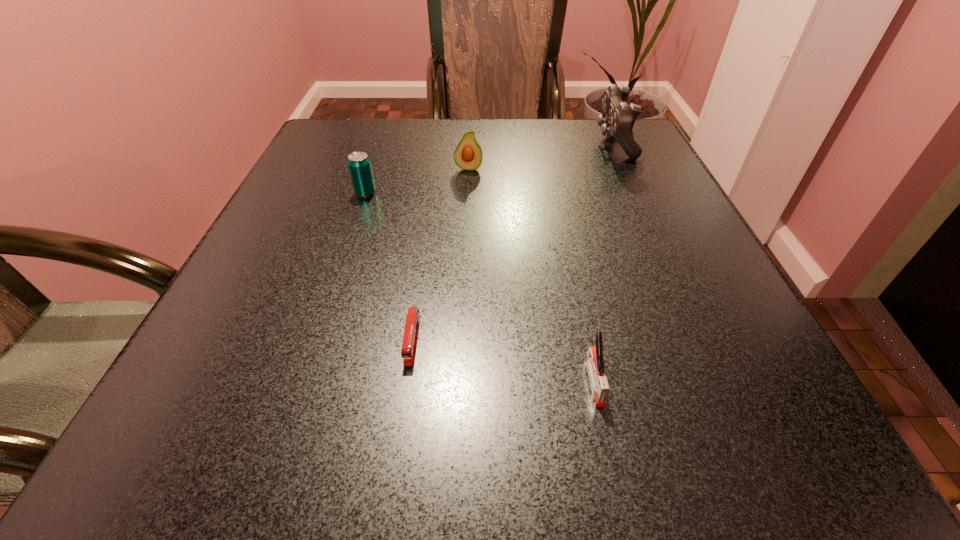
Locate an element on the screen. The image size is (960, 540). free space between the third object from right to left and the shortest object is located at coordinates (441, 254).

The height and width of the screenshot is (540, 960). What are the coordinates of `free point between the beer can and the avocado` in the screenshot? It's located at (417, 181).

Find the location of `empty space that is in between the beer can and the farthest object`. empty space that is in between the beer can and the farthest object is located at coordinates (490, 168).

The image size is (960, 540). I want to click on vacant region between the left stapler and the rightmost object, so click(x=513, y=241).

You are a GUI agent. You are given a task and a screenshot of the screen. Output one action in this format:
    pyautogui.click(x=<x>, y=<y>)
    Task: Click on the vacant area that lies between the leftmost object and the rightmost object
    
    Given the screenshot: What is the action you would take?
    pyautogui.click(x=490, y=168)

Identify the location of unoccupied position between the left stapler and the third object from left to right. (441, 254).

At what (x,y) coordinates should I click in order to perform the action: click on free space between the farthest object and the shortest object. Please return your answer as a coordinate pair (x, y). Looking at the image, I should click on (513, 241).

Where is `blank region between the fourth nearest object and the third nearest object`? The width and height of the screenshot is (960, 540). blank region between the fourth nearest object and the third nearest object is located at coordinates (417, 181).

Select which object appears as the third closest to the leftmost object. Please provide its 2D coordinates. Your answer should be formatted as a tuple, i.e. [(x, y)], where the tuple contains the x and y coordinates of a point satisfying the conditions above.

[(618, 119)]

Find the location of a particular element. The height and width of the screenshot is (540, 960). object that is the fourth nearest to the beer can is located at coordinates (594, 356).